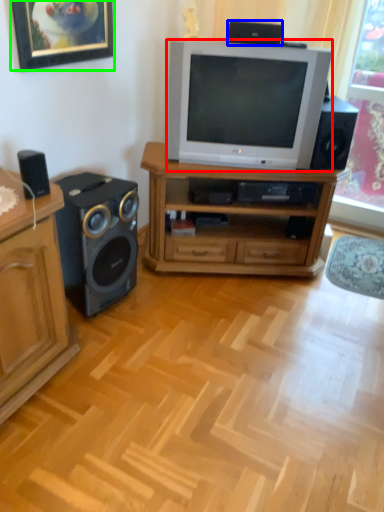
Question: Which is farther away from television (highlighted by a red box)? loudspeaker (highlighted by a blue box) or picture frame (highlighted by a green box)?

Choices:
 (A) loudspeaker
 (B) picture frame

Answer: (B)